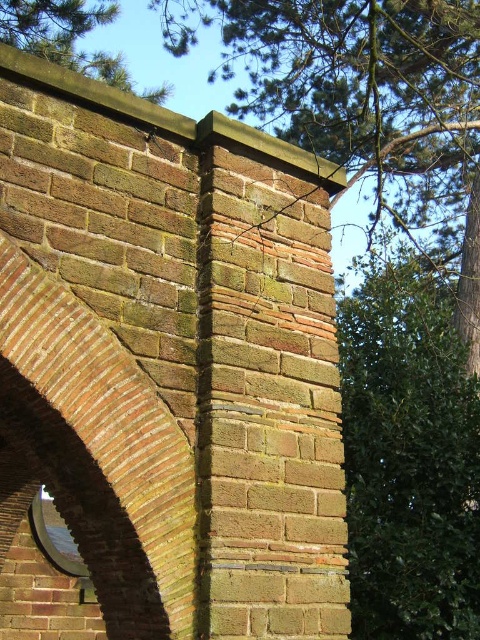
Question: Is rustic brick archway at left to the right of green leafy tree at upper left from the viewer's perspective?

Choices:
 (A) no
 (B) yes

Answer: (B)

Question: Which object is positioned farthest from the green leafy tree at upper center?

Choices:
 (A) rustic brick archway at left
 (B) green leafy tree at upper right

Answer: (A)

Question: Which point appears closest to the camera in this image?

Choices:
 (A) (63, 301)
 (B) (12, 12)

Answer: (A)

Question: From the image, what is the correct spatial relationship of rustic brick archway at left in relation to green leafy tree at upper left?

Choices:
 (A) left
 (B) right

Answer: (B)

Question: Does green leafy tree at upper center have a greater width compared to green leafy tree at upper left?

Choices:
 (A) no
 (B) yes

Answer: (B)

Question: Which point is farther from the camera taking this photo?

Choices:
 (A) (406, 600)
 (B) (140, 484)

Answer: (A)